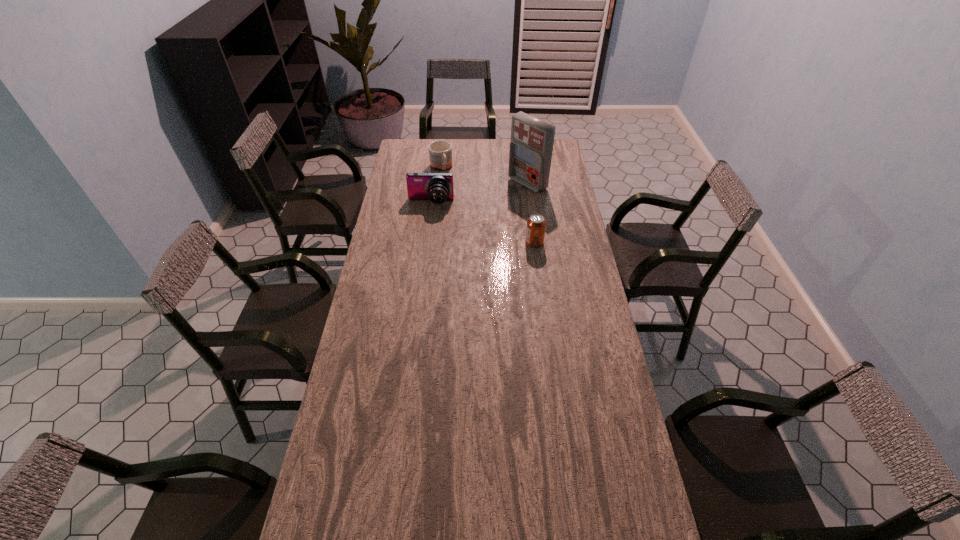
At what (x,y) coordinates should I click in order to perform the action: click on vacant spot on the desktop that is between the camera and the can and is positioned on the side with the handle of the shortest object. Please return your answer as a coordinate pair (x, y). The width and height of the screenshot is (960, 540). Looking at the image, I should click on (467, 217).

Where is `free spot on the desktop that is between the second nearest object and the nearest object and is positioned on the front-facing side of the tallest object`? free spot on the desktop that is between the second nearest object and the nearest object and is positioned on the front-facing side of the tallest object is located at coordinates (469, 218).